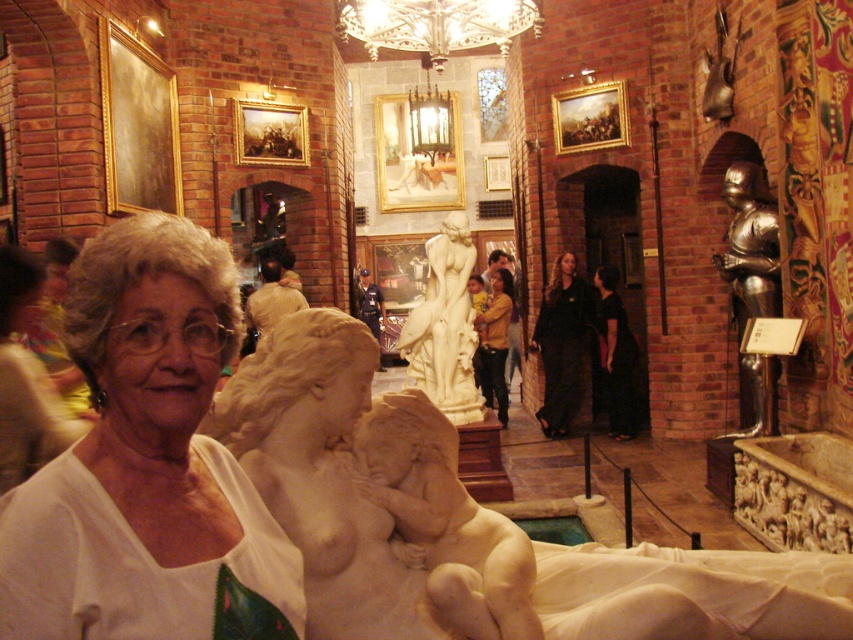
Question: Which object is farther from the camera taking this photo?

Choices:
 (A) black satin dress at center
 (B) white marble statue at center
 (C) goldwooden frame at upper center

Answer: (A)

Question: Estimate the real-world distances between objects in this image. Which object is closer to the black velvet dress at center?

Choices:
 (A) shiny bronze helmet at upper right
 (B) shiny metallic armor at right

Answer: (B)

Question: Does matte white statue at center appear over shiny metallic armor at right?

Choices:
 (A) no
 (B) yes

Answer: (A)

Question: Which point is farther to the camera?

Choices:
 (A) (157, 369)
 (B) (485, 384)

Answer: (B)

Question: Can you confirm if goldwooden frame at upper center is smaller than shiny bronze helmet at upper right?

Choices:
 (A) no
 (B) yes

Answer: (A)

Question: Is gold-framed mirror at upper center wider than goldwooden frame at upper center?

Choices:
 (A) no
 (B) yes

Answer: (B)